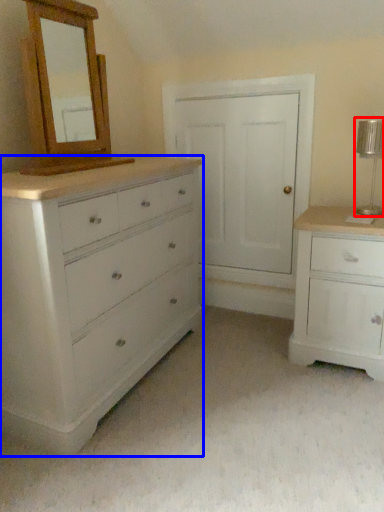
Question: Which object appears farthest to the camera in this image, table lamp (highlighted by a red box) or chest of drawers (highlighted by a blue box)?

Choices:
 (A) table lamp
 (B) chest of drawers

Answer: (A)